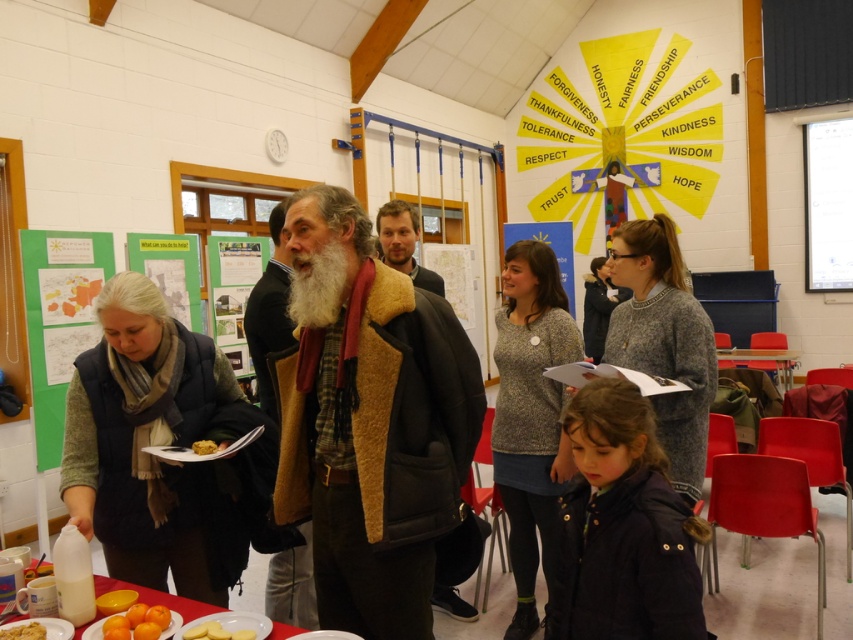
You are a guest at this event and want to choose a dessert that is taller between the yellow matte cookies at lower center and the yellow matte cake at center. Which one should you pick?

The yellow matte cookies at lower center has a greater height compared to the yellow matte cake at center, so you should pick the yellow matte cookies at lower center.

You are standing at the entrance of the community hall and want to find the yellow matte cookies at lower center. According to the coordinates provided, where should you look relative to the entrance?

The yellow matte cookies at lower center are located at coordinates point (219, 630), which would be near the lower central area of the image, so you should look towards the bottom middle part of the room from the entrance.